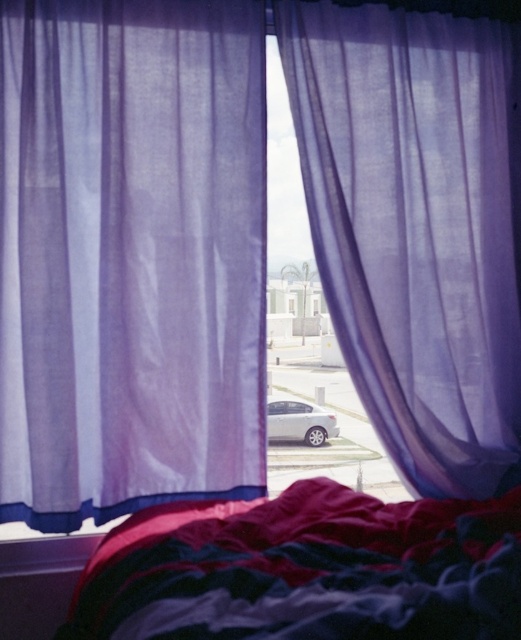
Question: Is translucent purple curtain at center thinner than satin silver sedan at center?

Choices:
 (A) yes
 (B) no

Answer: (B)

Question: Can you confirm if velvet-like red blanket at lower center is wider than satin silver sedan at center?

Choices:
 (A) yes
 (B) no

Answer: (A)

Question: Which point appears farthest from the camera in this image?

Choices:
 (A) (165, 616)
 (B) (59, 131)
 (C) (452, 285)
 (D) (321, 435)

Answer: (D)

Question: Observing the image, what is the correct spatial positioning of sheer purple curtain at left in reference to translucent purple curtain at center?

Choices:
 (A) below
 (B) above

Answer: (A)

Question: Based on their relative distances, which object is nearer to the satin silver sedan at center?

Choices:
 (A) sheer purple curtain at left
 (B) velvet-like red blanket at lower center
 (C) translucent purple curtain at center

Answer: (B)

Question: Which object is closer to the camera taking this photo?

Choices:
 (A) sheer purple curtain at left
 (B) velvet-like red blanket at lower center
 (C) satin silver sedan at center

Answer: (B)